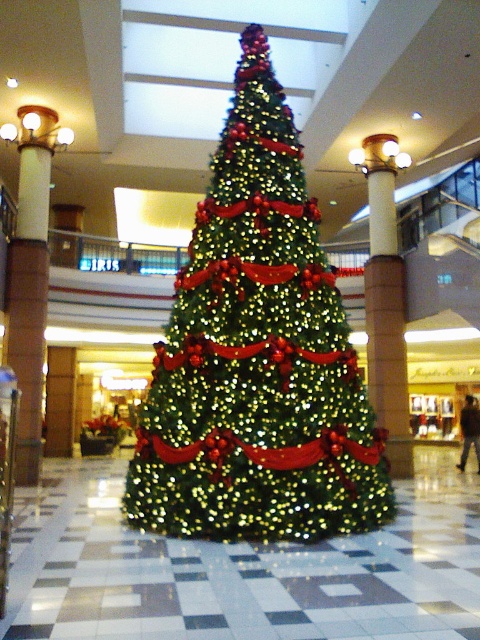
Question: Which of the following is the farthest from the observer?

Choices:
 (A) (59, 620)
 (B) (335, 289)

Answer: (B)

Question: Is green matte christmas tree at center positioned behind green shiny christmas tree at center?

Choices:
 (A) yes
 (B) no

Answer: (A)

Question: From the image, what is the correct spatial relationship of green matte christmas tree at center in relation to green shiny christmas tree at center?

Choices:
 (A) right
 (B) left

Answer: (B)

Question: Can you confirm if green matte christmas tree at center is positioned to the left of green shiny christmas tree at center?

Choices:
 (A) no
 (B) yes

Answer: (B)